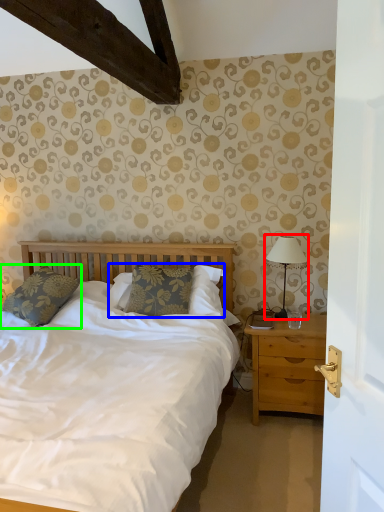
Question: Estimate the real-world distances between objects in this image. Which object is closer to bedside lamp (highlighted by a red box), pillow (highlighted by a blue box) or pillow (highlighted by a green box)?

Choices:
 (A) pillow
 (B) pillow

Answer: (A)